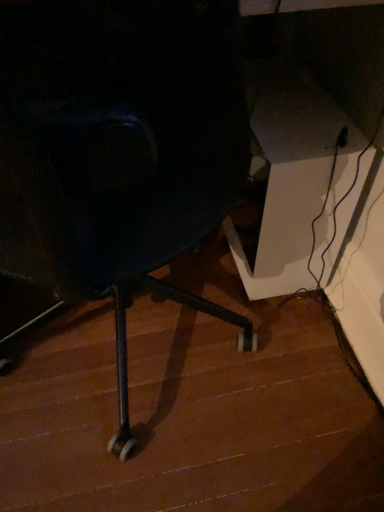
The width and height of the screenshot is (384, 512). What are the coordinates of `free space above white glossy table at right (from a real-world perspective)` in the screenshot? It's located at (285, 105).